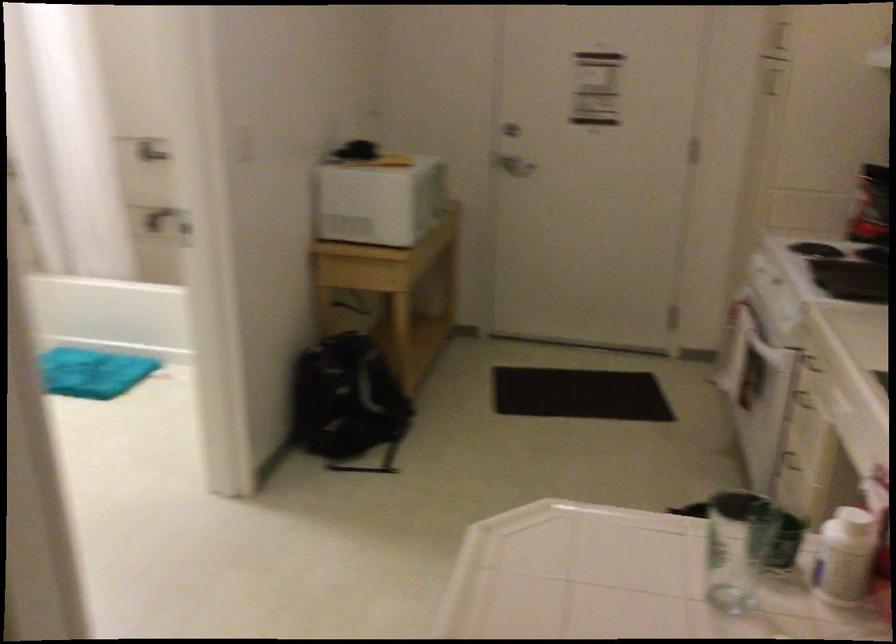
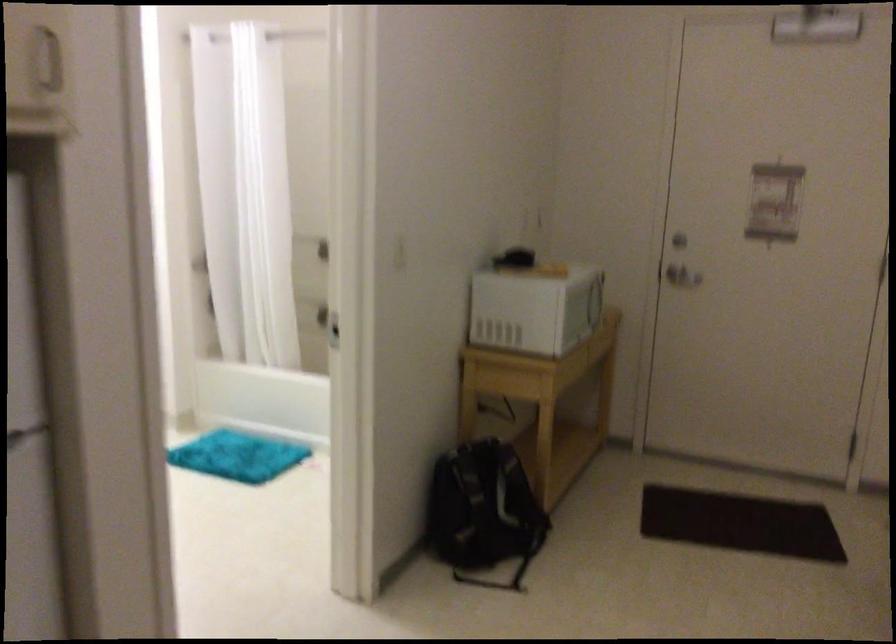
Where in the second image is the point corresponding to point 131,147 from the first image?

(309, 245)